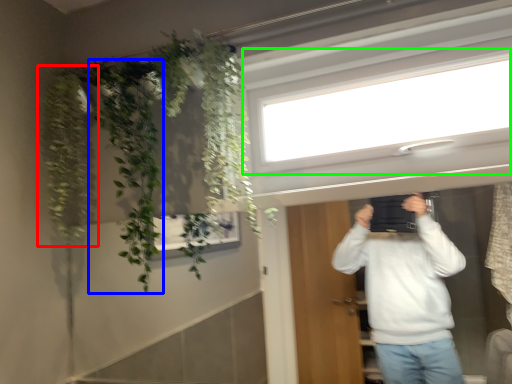
Question: Which object is positioned closest to plant (highlighted by a red box)? Select from plant (highlighted by a blue box) and window (highlighted by a green box).

Choices:
 (A) plant
 (B) window

Answer: (A)